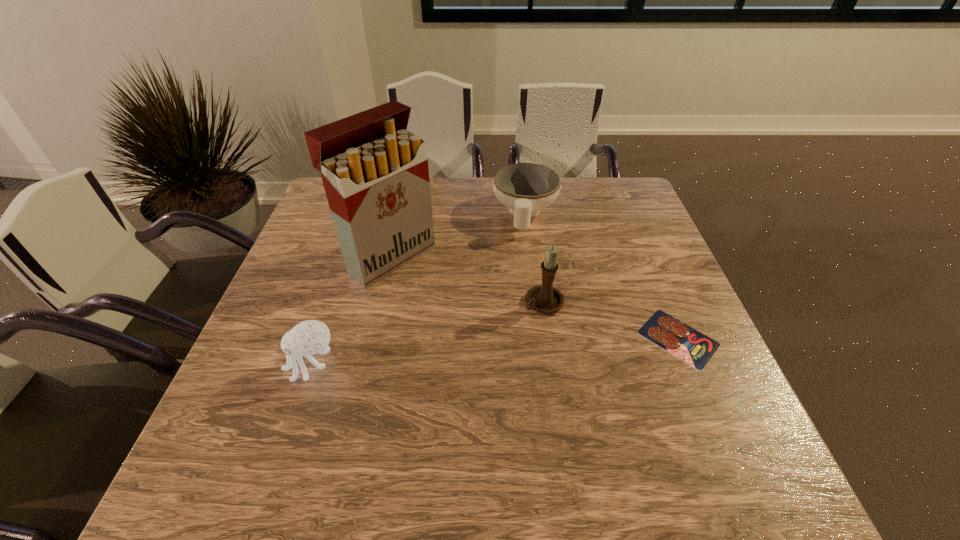
Where is `free space located 0.140m with the lid open on the cigarette case`? free space located 0.140m with the lid open on the cigarette case is located at coordinates (x=457, y=306).

Identify the location of vacant space situated with the lid open on the cigarette case. (540, 364).

Find the location of a particular element. Image resolution: width=960 pixels, height=540 pixels. free space located on the side with the handle of the fourth tallest object is located at coordinates (520, 255).

The width and height of the screenshot is (960, 540). I want to click on vacant space located on the side with the handle of the fourth tallest object, so click(520, 257).

Locate an element on the screen. free space located 0.060m on the side with the handle of the fourth tallest object is located at coordinates (520, 252).

Image resolution: width=960 pixels, height=540 pixels. What are the coordinates of `blank area located 0.400m on the side of the fourth shortest object with the handle` in the screenshot? It's located at pyautogui.click(x=381, y=409).

The height and width of the screenshot is (540, 960). What are the coordinates of `vacant space situated 0.380m on the side of the fourth shortest object with the handle` in the screenshot? It's located at (390, 403).

Image resolution: width=960 pixels, height=540 pixels. I want to click on free space located on the side of the fourth shortest object with the handle, so click(403, 395).

You are a GUI agent. You are given a task and a screenshot of the screen. Output one action in this format:
    pyautogui.click(x=<x>, y=<y>)
    Task: Click on the object located in the far edge section of the desktop
    Image resolution: width=960 pixels, height=540 pixels.
    Given the screenshot: What is the action you would take?
    pyautogui.click(x=526, y=188)

The image size is (960, 540). Find the location of `octopus that is at the left edge`. octopus that is at the left edge is located at coordinates (309, 337).